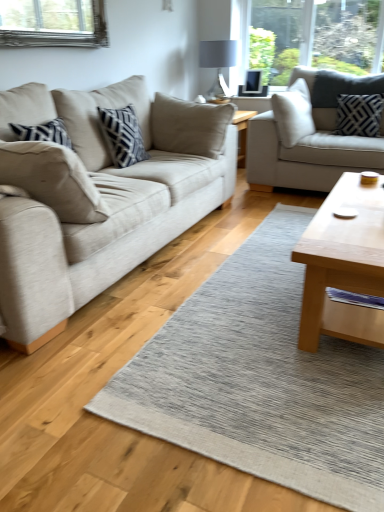
Measure the distance between point (x=347, y=198) and camera.

The distance of point (x=347, y=198) from camera is 6.62 feet.

Find the location of a particular element. The image size is (384, 512). light gray fabric couch at upper right, placed as the second studio couch when sorted from left to right is located at coordinates (311, 135).

What do you see at coordinates (359, 114) in the screenshot?
I see `black textured pillow at upper right, arranged as the first pillow when viewed from the back` at bounding box center [359, 114].

Locate an element on the screen. This screenshot has width=384, height=512. beige fabric pillow at left, which ranks as the second pillow in right-to-left order is located at coordinates (53, 179).

In order to face beige fabric couch at left, the 2th studio couch positioned from the right, should I rotate leftwards or rightwards?

It's best to rotate left around 12.265 degrees.

The height and width of the screenshot is (512, 384). I want to click on matte gray glass lampshade at upper center, so click(217, 61).

In terms of width, does beige fabric pillow at left, which ranks as the 2th pillow in top-to-bottom order, look wider or thinner when compared to matte gray glass lampshade at upper center?

beige fabric pillow at left, which ranks as the 2th pillow in top-to-bottom order, is thinner than matte gray glass lampshade at upper center.

Is beige fabric pillow at left, placed as the first pillow when sorted from bottom to top, positioned with its back to matte gray glass lampshade at upper center?

No, matte gray glass lampshade at upper center is not at the back of beige fabric pillow at left, placed as the first pillow when sorted from bottom to top.

Can you confirm if beige fabric pillow at left, the 1th pillow from the left, is taller than matte gray glass lampshade at upper center?

No.

From a real-world perspective, is black textured pillow at upper right, arranged as the first pillow when viewed from the top, under matte gray glass lampshade at upper center?

Yes, from a real-world perspective, black textured pillow at upper right, arranged as the first pillow when viewed from the top, is under matte gray glass lampshade at upper center.

Does black textured pillow at upper right, arranged as the first pillow when viewed from the back, lie in front of matte gray glass lampshade at upper center?

Yes, it is in front of matte gray glass lampshade at upper center.

Between black textured pillow at upper right, arranged as the first pillow when viewed from the top, and matte gray glass lampshade at upper center, which one has more height?

With more height is matte gray glass lampshade at upper center.

Does black textured pillow at upper right, arranged as the first pillow when viewed from the back, have a greater width compared to matte gray glass lampshade at upper center?

No, black textured pillow at upper right, arranged as the first pillow when viewed from the back, is not wider than matte gray glass lampshade at upper center.

Is light brown wooden coffee table at center right facing towards textured gray rug at center?

No, light brown wooden coffee table at center right is not turned towards textured gray rug at center.

Which object is thinner, light brown wooden coffee table at center right or textured gray rug at center?

light brown wooden coffee table at center right.

Would you say light brown wooden coffee table at center right is a long distance from textured gray rug at center?

No, light brown wooden coffee table at center right is not far from textured gray rug at center.

From the image's perspective, is light brown wooden coffee table at center right below textured gray rug at center?

Incorrect, from the image's perspective, light brown wooden coffee table at center right is higher than textured gray rug at center.

Locate an element on the screen. The height and width of the screenshot is (512, 384). coffee table below the matte gray glass lampshade at upper center (from a real-world perspective) is located at coordinates 343,266.

Considering the relative sizes of matte gray glass lampshade at upper center and light brown wooden coffee table at center right in the image provided, is matte gray glass lampshade at upper center shorter than light brown wooden coffee table at center right?

No, matte gray glass lampshade at upper center is not shorter than light brown wooden coffee table at center right.

Between point (222, 60) and point (375, 185), which one is positioned behind?

Point (222, 60)

Which of these two, matte gray glass lampshade at upper center or light brown wooden coffee table at center right, is wider?

With larger width is matte gray glass lampshade at upper center.

From the image's perspective, is light brown wooden coffee table at center right located above black textured pillow at upper right, arranged as the first pillow when viewed from the back?

Actually, light brown wooden coffee table at center right appears below black textured pillow at upper right, arranged as the first pillow when viewed from the back, in the image.

From the picture: How far apart are light brown wooden coffee table at center right and black textured pillow at upper right, positioned as the second pillow in front-to-back order?

A distance of 1.94 meters exists between light brown wooden coffee table at center right and black textured pillow at upper right, positioned as the second pillow in front-to-back order.

Find the location of `coffee table lying below the black textured pillow at upper right, acting as the 1th pillow starting from the right (from the image's perspective)`. coffee table lying below the black textured pillow at upper right, acting as the 1th pillow starting from the right (from the image's perspective) is located at coordinates (343, 266).

Which point is more distant from viewer, (369, 220) or (351, 105)?

Point (351, 105)

Which is in front, point (193, 139) or point (361, 112)?

The point (193, 139) is more forward.

Is beige fabric couch at left, the first studio couch positioned from the left, inside the boundaries of black textured pillow at upper right, arranged as the first pillow when viewed from the back, or outside?

beige fabric couch at left, the first studio couch positioned from the left, is not enclosed by black textured pillow at upper right, arranged as the first pillow when viewed from the back.

The height and width of the screenshot is (512, 384). Identify the location of the 2nd studio couch in front of the black textured pillow at upper right, arranged as the first pillow when viewed from the back. (99, 197).

Is beige fabric couch at left, the first studio couch positioned from the left, directly adjacent to black textured pillow at upper right, arranged as the first pillow when viewed from the back?

No, beige fabric couch at left, the first studio couch positioned from the left, is not beside black textured pillow at upper right, arranged as the first pillow when viewed from the back.

Is light gray fabric couch at upper right, marked as the 1th studio couch in a right-to-left arrangement, facing away from light brown wooden coffee table at center right?

light gray fabric couch at upper right, marked as the 1th studio couch in a right-to-left arrangement, does not have its back to light brown wooden coffee table at center right.

From a real-world perspective, is light gray fabric couch at upper right, placed as the second studio couch when sorted from left to right, physically located above or below light brown wooden coffee table at center right?

light gray fabric couch at upper right, placed as the second studio couch when sorted from left to right, is above light brown wooden coffee table at center right.

Is point (258, 153) closer or farther from the camera than point (303, 234)?

Point (258, 153).

The width and height of the screenshot is (384, 512). Identify the location of lamp positioned vertically above the beige fabric pillow at left, which is the 2th pillow in back-to-front order (from a real-world perspective). (217, 61).

Identify the location of lamp that is behind the black textured pillow at upper right, acting as the 1th pillow starting from the right. (217, 61).

Looking at the image, which one is located closer to black textured pillow at upper right, arranged as the first pillow when viewed from the back, matte gray glass lampshade at upper center or beige fabric couch at left, the first studio couch positioned from the left?

The object closer to black textured pillow at upper right, arranged as the first pillow when viewed from the back, is matte gray glass lampshade at upper center.

When comparing their distances from textured gray rug at center, does beige fabric couch at left, the 2th studio couch positioned from the right, or beige fabric pillow at left, which is counted as the 1th pillow, starting from the front, seem further?

beige fabric pillow at left, which is counted as the 1th pillow, starting from the front, is positioned further to the anchor textured gray rug at center.

Considering their positions, is matte gray glass lampshade at upper center positioned closer to beige fabric couch at left, the 2th studio couch positioned from the right, than light gray fabric couch at upper right, marked as the 1th studio couch in a right-to-left arrangement?

light gray fabric couch at upper right, marked as the 1th studio couch in a right-to-left arrangement.

Which object lies nearer to the anchor point light gray fabric couch at upper right, marked as the 1th studio couch in a right-to-left arrangement, beige fabric pillow at left, which is counted as the 1th pillow, starting from the front, or matte gray glass lampshade at upper center?

matte gray glass lampshade at upper center is closer to light gray fabric couch at upper right, marked as the 1th studio couch in a right-to-left arrangement.

Based on their spatial positions, is black textured pillow at upper right, arranged as the second pillow when viewed from the left, or matte gray glass lampshade at upper center closer to textured gray rug at center?

black textured pillow at upper right, arranged as the second pillow when viewed from the left, lies closer to textured gray rug at center than the other object.

Which object lies nearer to the anchor point light gray fabric couch at upper right, marked as the 1th studio couch in a right-to-left arrangement, beige fabric couch at left, the 2th studio couch positioned from the right, or light brown wooden coffee table at center right?

Among the two, beige fabric couch at left, the 2th studio couch positioned from the right, is located nearer to light gray fabric couch at upper right, marked as the 1th studio couch in a right-to-left arrangement.

Considering their positions, is textured gray rug at center positioned further to light brown wooden coffee table at center right than beige fabric pillow at left, which ranks as the 2th pillow in top-to-bottom order?

The object further to light brown wooden coffee table at center right is beige fabric pillow at left, which ranks as the 2th pillow in top-to-bottom order.

Which object lies nearer to the anchor point textured gray rug at center, matte gray glass lampshade at upper center or beige fabric pillow at left, which ranks as the second pillow in right-to-left order?

beige fabric pillow at left, which ranks as the second pillow in right-to-left order, is closer to textured gray rug at center.

Image resolution: width=384 pixels, height=512 pixels. What are the coordinates of `studio couch between light brown wooden coffee table at center right and matte gray glass lampshade at upper center from front to back` in the screenshot? It's located at (311, 135).

At what (x,y) coordinates should I click in order to perform the action: click on coffee table between beige fabric pillow at left, which is the 2th pillow in back-to-front order, and light gray fabric couch at upper right, marked as the 1th studio couch in a right-to-left arrangement, from left to right. Please return your answer as a coordinate pair (x, y). Image resolution: width=384 pixels, height=512 pixels. Looking at the image, I should click on (343, 266).

Where is `coffee table between beige fabric couch at left, the first studio couch positioned from the left, and matte gray glass lampshade at upper center from front to back`? coffee table between beige fabric couch at left, the first studio couch positioned from the left, and matte gray glass lampshade at upper center from front to back is located at coordinates click(x=343, y=266).

Where is `studio couch between beige fabric couch at left, the first studio couch positioned from the left, and matte gray glass lampshade at upper center, along the z-axis`? The image size is (384, 512). studio couch between beige fabric couch at left, the first studio couch positioned from the left, and matte gray glass lampshade at upper center, along the z-axis is located at coordinates (311, 135).